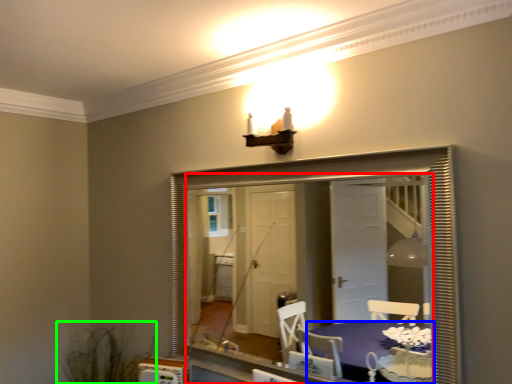
Question: Which object is positioned farthest from mirror (highlighted by a red box)? Select from table (highlighted by a blue box) and plant (highlighted by a green box).

Choices:
 (A) table
 (B) plant

Answer: (B)